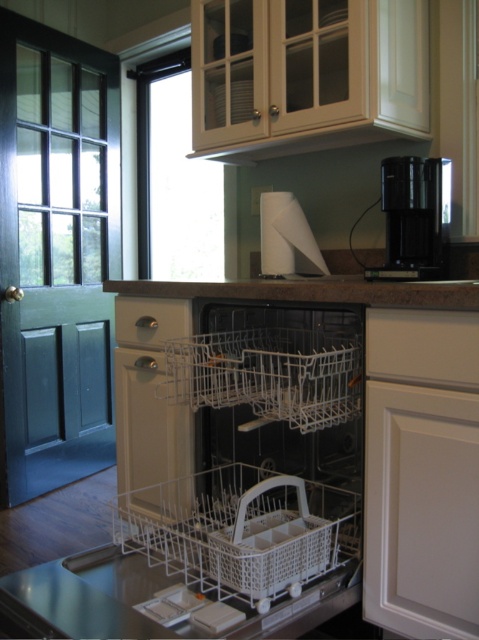
What object is located at the point with coordinates (x=239, y=444)?

The white plastic dish washer at center is located at the point with coordinates (x=239, y=444).

You are a kitchen assistant who needs to place a 12 inch wide cake on the countertop. The white plastic basket at center and the black plastic coffee machine at upper right are on the countertop. Is there enough space between them to place the cake?

The white plastic basket at center is 33.97 inches from the black plastic coffee machine at upper right. Since the cake is only 12 inches wide, there is more than enough space between them to place the cake.

You are standing in front of the dishwasher and want to reach both points. Which point, point (216,296) or point (438,243), is closer to you?

Point (216,296) is closer to you than point (438,243).